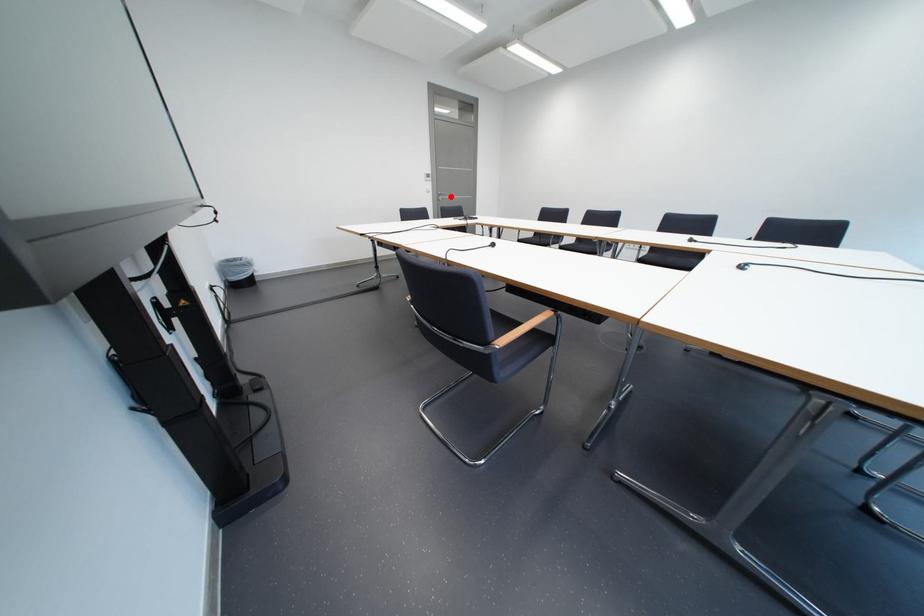
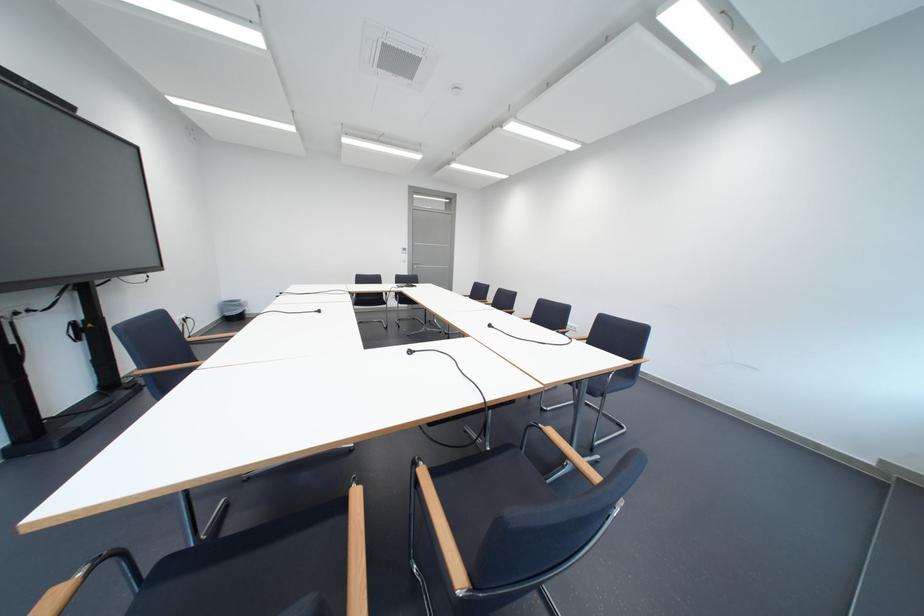
Locate, in the second image, the point that corresponds to the highlighted location in the first image.

(426, 265)